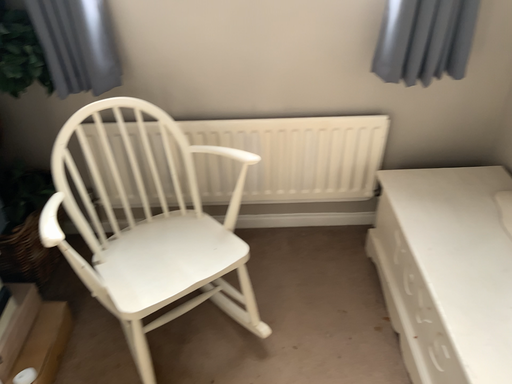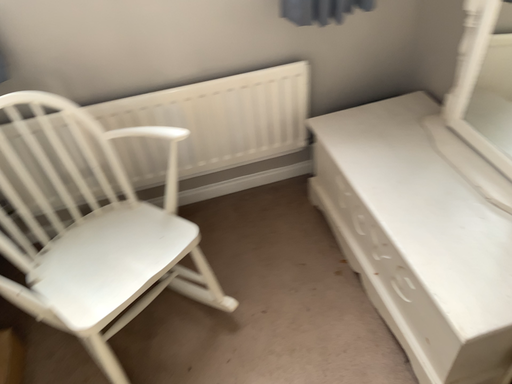
Question: Which way did the camera rotate in the video?

Choices:
 (A) rotated right
 (B) rotated left

Answer: (A)